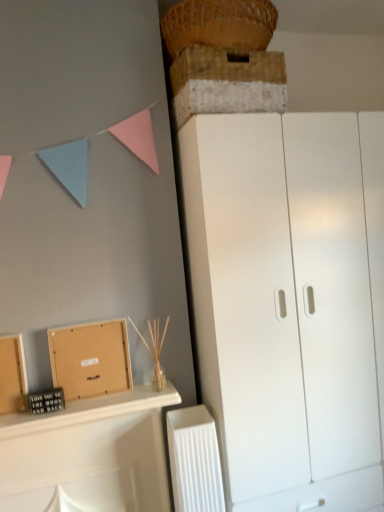
The height and width of the screenshot is (512, 384). I want to click on vacant area that lies to the right of brown cardboard box at lower left, so click(x=119, y=394).